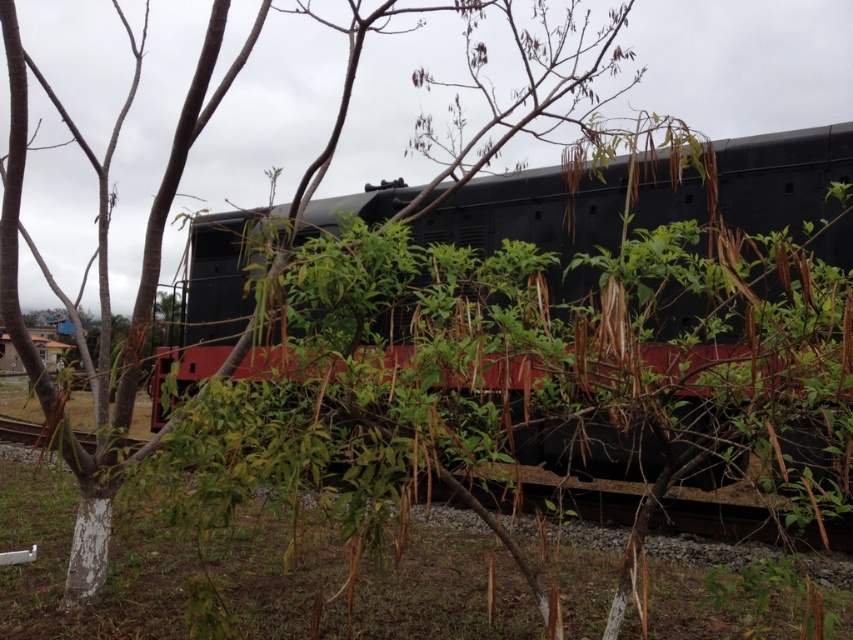
You are a maintenance worker inspecting the railway. You need to place a 1.2 meter wide equipment box between the matte black train at center and the black metal train track at center. Is there enough space for the equipment box?

The matte black train at center is thinner than the black metal train track at center. Therefore, the space between them is sufficient to accommodate a 1.2 meter wide equipment box.

You are a maintenance worker inspecting the railway. You notice the matte black train at center and the black metal train track at center. Which object is directly above the other?

The matte black train at center is positioned over the black metal train track at center.